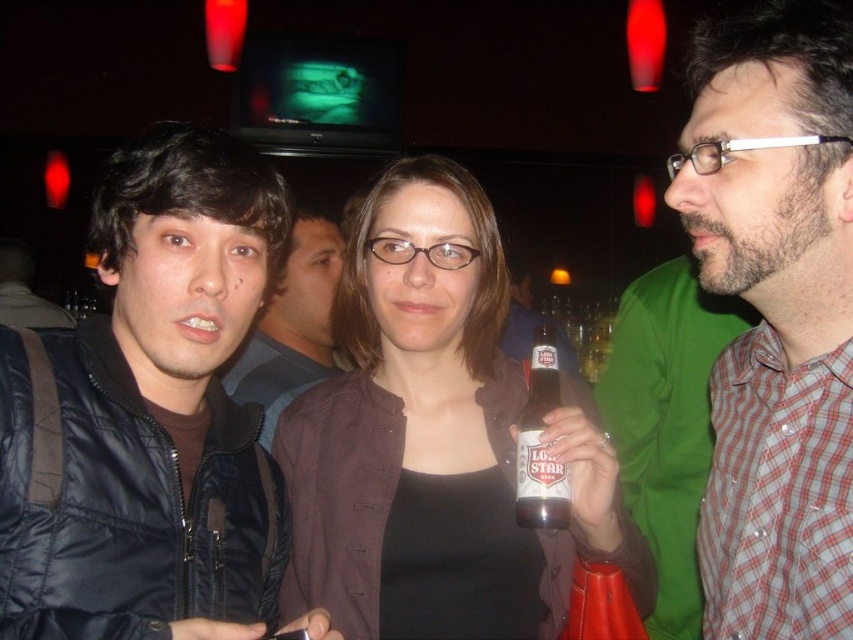
You are a photographer trying to capture a candid shot of the brown glass beer bottle at center without including the black matte jacket at left in the frame. Based on their positions, is this possible?

The black matte jacket at left is in front of the brown glass beer bottle at center, so it would block the view. To capture the beer bottle without the jacket, you need to adjust your angle or move around the jacket to ensure the bottle is visible behind it.